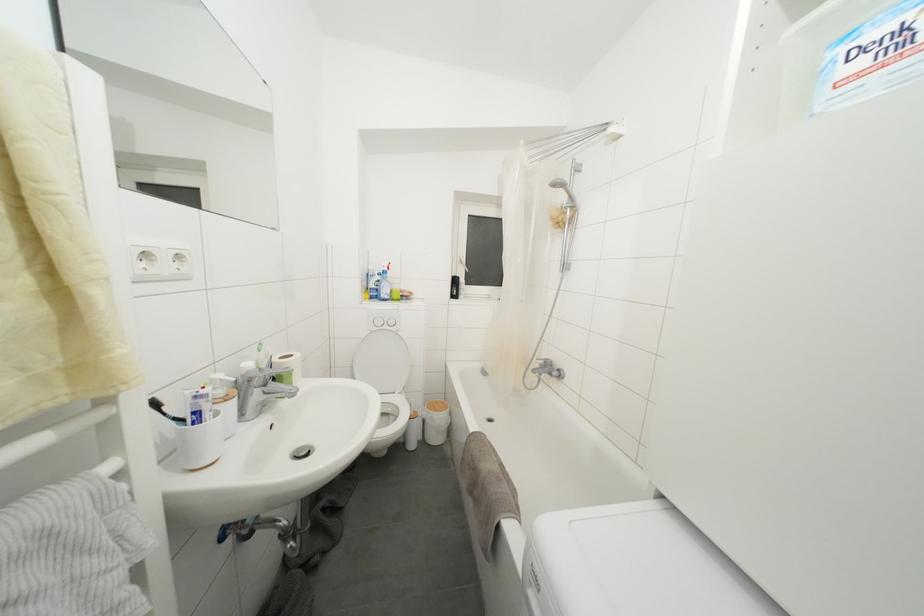
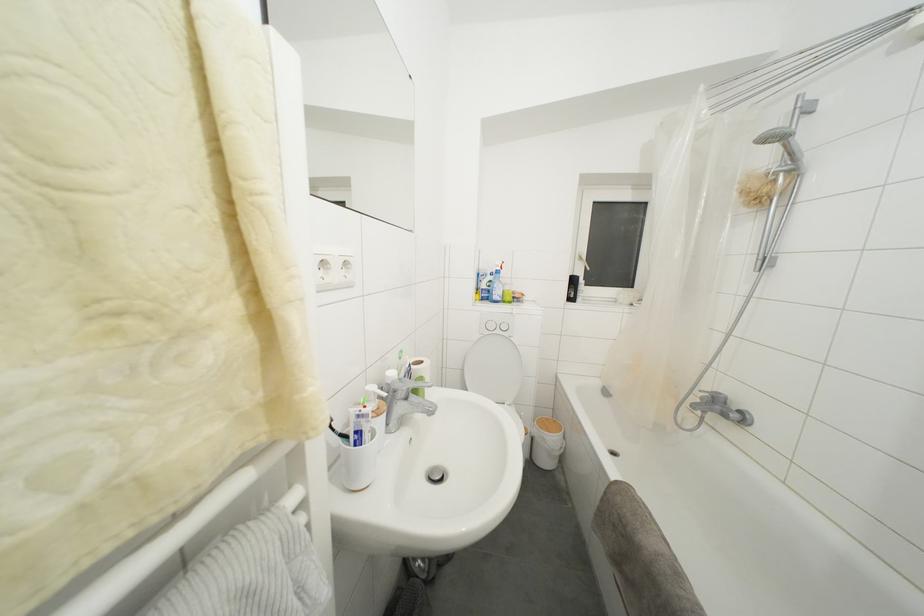
In the second image, find the point that corresponds to point 540,362 in the first image.

(703, 392)